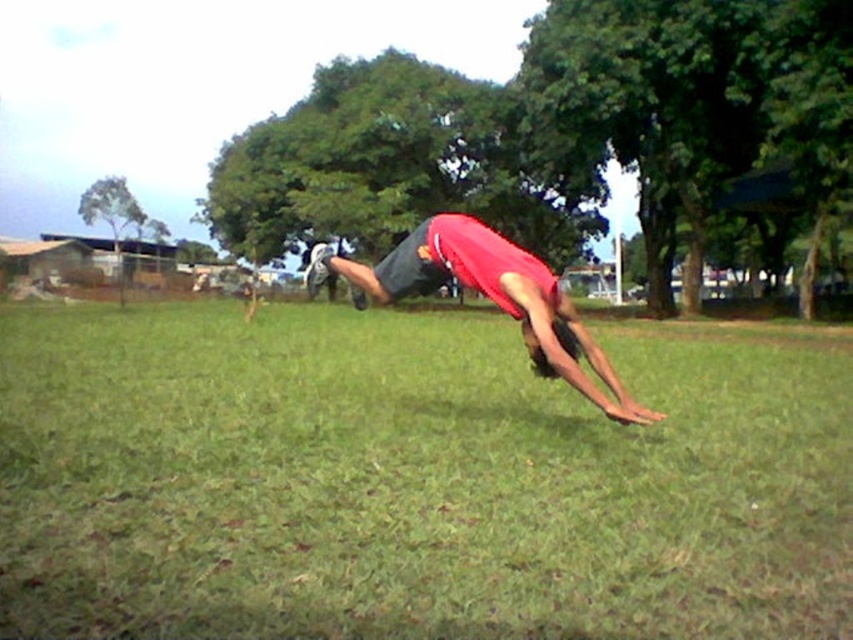
Question: Does green grass at center appear on the left side of red matte shirt at center?

Choices:
 (A) no
 (B) yes

Answer: (B)

Question: Which point is closer to the camera?

Choices:
 (A) (838, 557)
 (B) (527, 300)

Answer: (A)

Question: Can you confirm if green grass at center is bigger than red matte shirt at center?

Choices:
 (A) no
 (B) yes

Answer: (A)

Question: In this image, where is green grass at center located relative to red matte shirt at center?

Choices:
 (A) right
 (B) left

Answer: (B)

Question: Which of the following is the closest to the observer?

Choices:
 (A) (622, 364)
 (B) (416, 268)

Answer: (B)